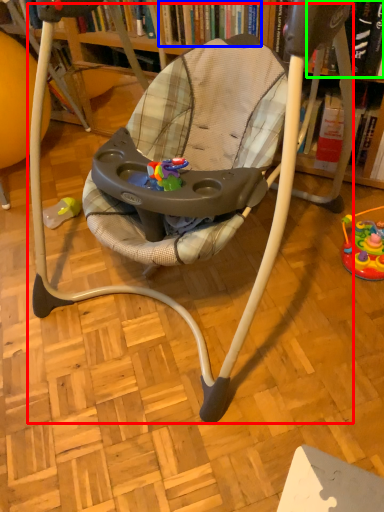
Question: Which object is the closest to the baby carriage (highlighted by a red box)? Choose among these: book (highlighted by a blue box) or book (highlighted by a green box).

Choices:
 (A) book
 (B) book

Answer: (A)